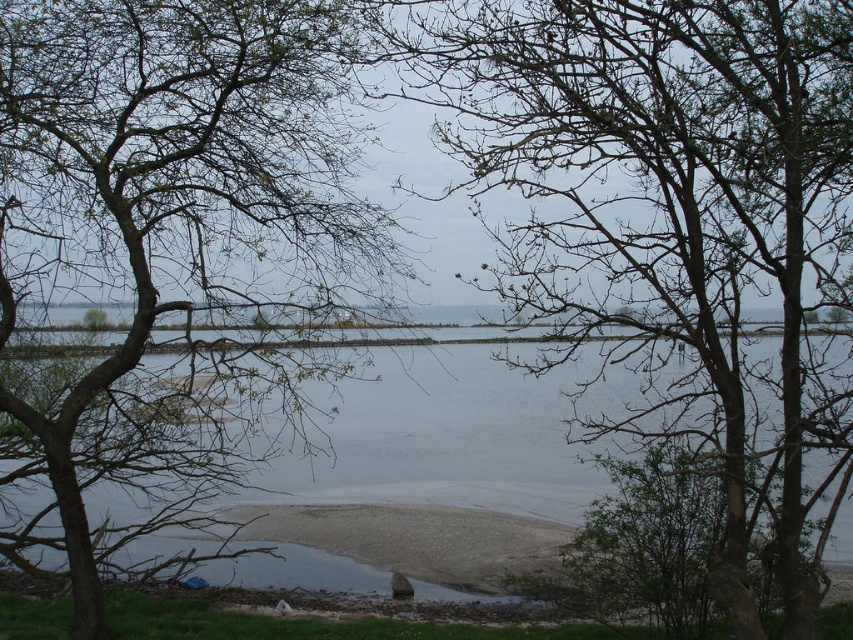
Based on the photo, between bare branches at center and clear water at center, which one appears on the right side from the viewer's perspective?

From the viewer's perspective, bare branches at center appears more on the right side.

Is bare branches at center wider than clear water at center?

Correct, the width of bare branches at center exceeds that of clear water at center.

Identify the location of bare branches at center. (670, 228).

I want to click on bare branches at center, so click(670, 228).

I want to click on bare branches at center, so click(x=670, y=228).

Does bare branches at center lie in front of bare branches at left?

Yes.

Between point (782, 344) and point (338, 176), which one is positioned in front?

Point (782, 344) is in front.

This screenshot has width=853, height=640. What are the coordinates of `bare branches at center` in the screenshot? It's located at 670,228.

Does point (100, 244) come closer to viewer compared to point (341, 401)?

No, (100, 244) is further to viewer.

Is point (126, 538) farther from viewer compared to point (463, 502)?

That is False.

The width and height of the screenshot is (853, 640). What are the coordinates of `bare branches at left` in the screenshot? It's located at (172, 246).